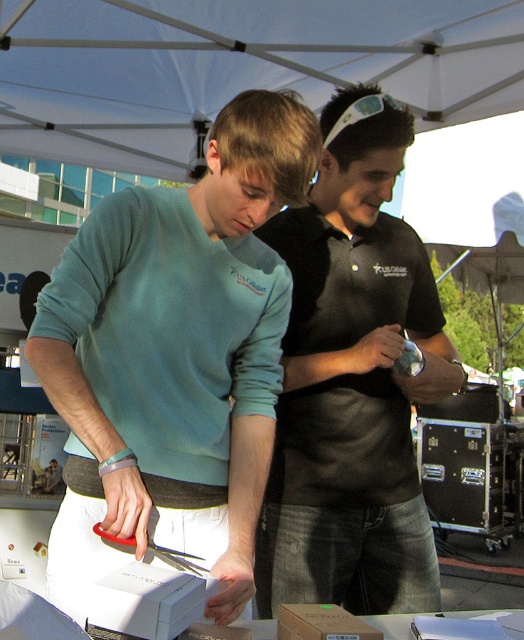
You are at an outdoor event and see two people under a white canopy tent. You notice a matte blue sweater at center and a black matte shirt at center. Which one is positioned more to the left side?

The matte blue sweater at center is positioned more to the left side than the black matte shirt at center.

You are organizing a small event and need to place a matte blue sweater at center and a white matte box at center into a storage container. If the container can only fit one of them, which item should you prioritize placing first based on their sizes?

The matte blue sweater at center is larger in size than the white matte box at center, so you should prioritize placing the matte blue sweater at center first to ensure it fits in the container.

You are at an outdoor event and see two points marked on the ground. The first point is at coordinates point [234,444] and the second point is at point [308,374]. If you are facing north, which point is closer to you?

Point [234,444] is in front of point [308,374], so if you are facing north, point [234,444] is closer to you.